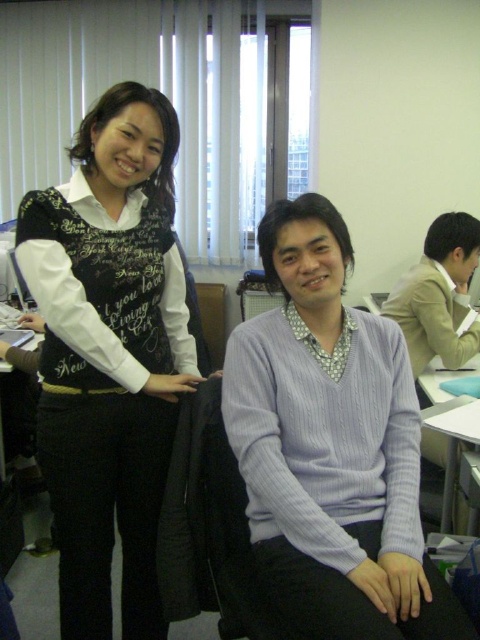
You are organizing a charity event and need to arrange these two items on a display shelf. The shelf has a height limit of 1 meter. Given that the black matte vest at left is below the light brown wool sweater at center, can you place both items on the shelf without exceeding the height limit?

The black matte vest at left is below the light brown wool sweater at center, so their combined height would depend on individual measurements. However, since the shelf has a 1 meter height limit, you can arrange them vertically as long as each item individually does not exceed the limit. If both items are within the height limit when placed separately, stacking them vertically should be acceptable.

From the picture: You are an assistant organizing a clothing store inventory. You have to place the black matte vest at left and the light brown wool sweater at center on two adjacent hangers. The store requires that taller items should be placed on the higher hanger. Which item should go on the higher hanger?

The black matte vest at left is taller than the light brown wool sweater at center, so the black matte vest at left should be placed on the higher hanger.